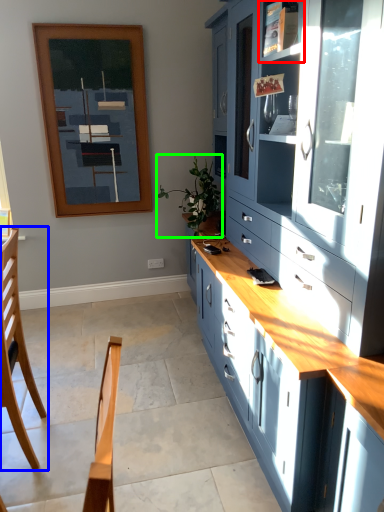
Question: Estimate the real-world distances between objects in this image. Which object is closer to shelf (highlighted by a red box), chair (highlighted by a blue box) or plant (highlighted by a green box)?

Choices:
 (A) chair
 (B) plant

Answer: (B)